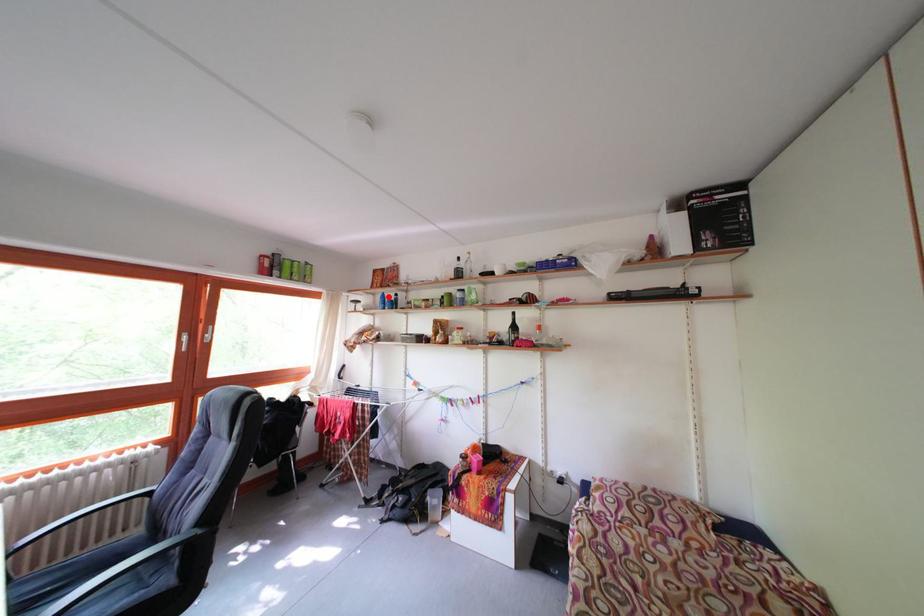
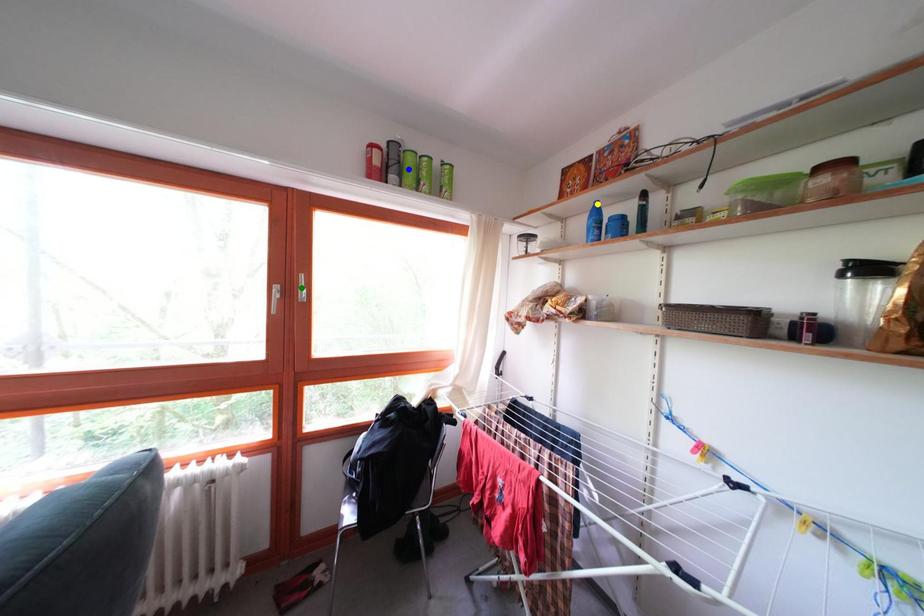
Question: I am providing you with two images of the same scene from different viewpoints. A red point is marked on the first image. You are given multiple points on the second image. In image 2, which mark is for the same physical point as the one in image 1?

Choices:
 (A) yellow point
 (B) blue point
 (C) green point

Answer: (A)